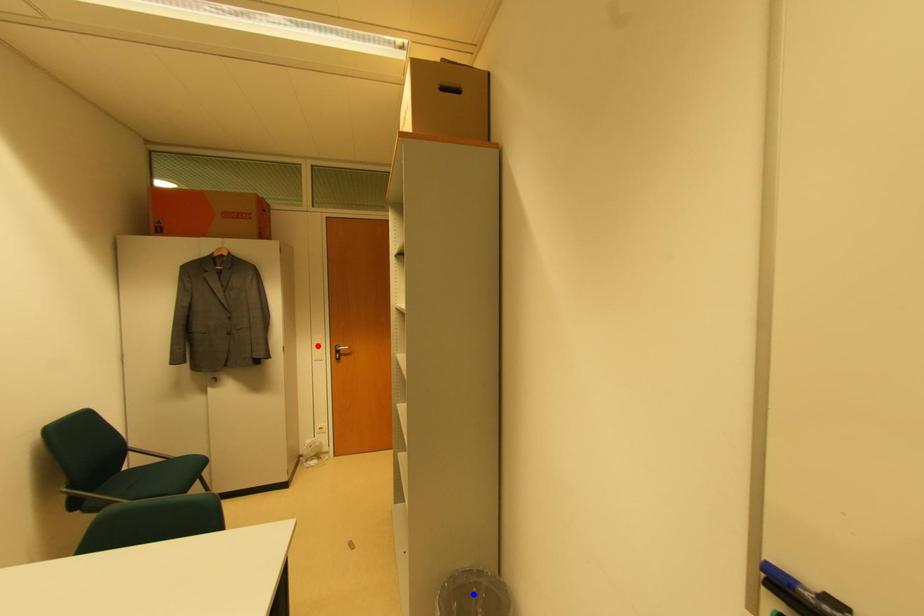
Question: Which of the two points in the image is closer to the camera?

Choices:
 (A) Blue point is closer.
 (B) Red point is closer.

Answer: (A)